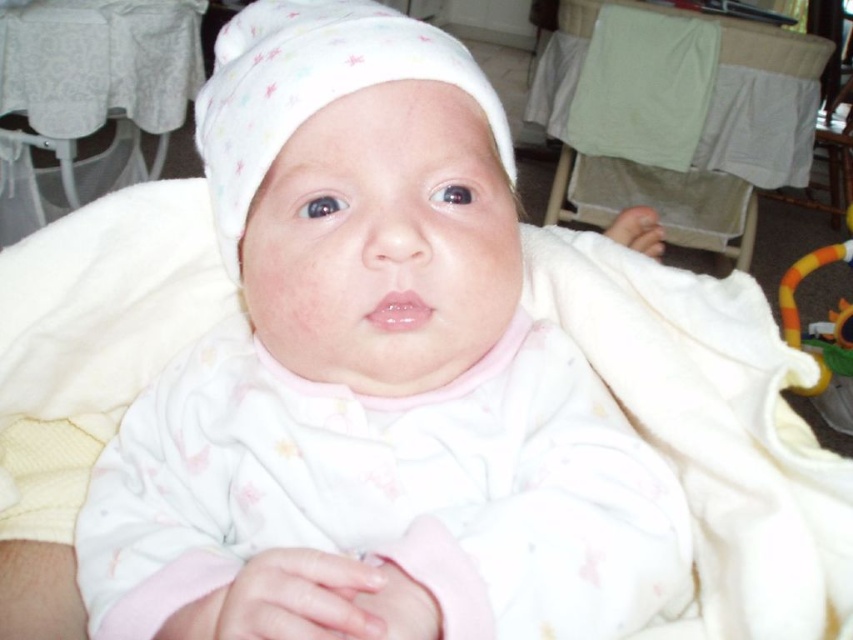
Question: Among these objects, which one is nearest to the camera?

Choices:
 (A) white soft baby at center
 (B) white soft hat at center

Answer: (A)

Question: Is white soft baby at center positioned at the back of white soft hat at center?

Choices:
 (A) yes
 (B) no

Answer: (B)

Question: Which point is farther from the camera taking this photo?

Choices:
 (A) (463, 241)
 (B) (253, 36)

Answer: (B)

Question: Can you confirm if white soft baby at center is positioned to the left of white soft hat at center?

Choices:
 (A) no
 (B) yes

Answer: (A)

Question: Where is white soft baby at center located in relation to white soft hat at center in the image?

Choices:
 (A) below
 (B) above

Answer: (A)